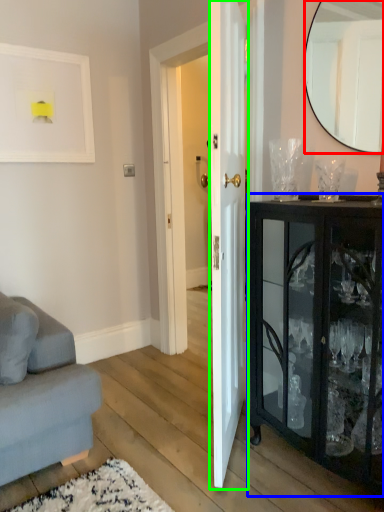
Question: Based on their relative distances, which object is nearer to mirror (highlighted by a red box)? Choose from cabinetry (highlighted by a blue box) and door (highlighted by a green box).

Choices:
 (A) cabinetry
 (B) door

Answer: (B)